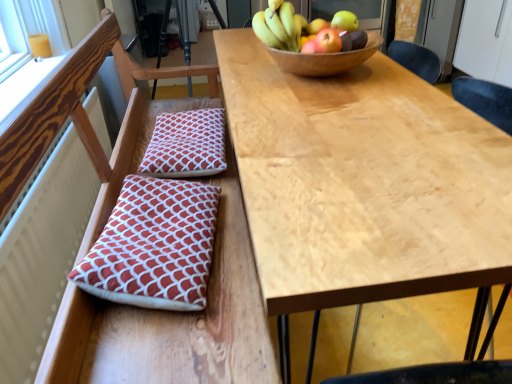
Question: From the image's perspective, is shiny yellow apple at upper right, acting as the 2th apple starting from the back, located above or below matte red apple at upper right, the 3th apple when ordered from back to front?

Choices:
 (A) below
 (B) above

Answer: (B)

Question: From their relative heights in the image, would you say shiny yellow apple at upper right, the 2th apple in the front-to-back sequence, is taller or shorter than matte red apple at upper right, the 3th apple when ordered from back to front?

Choices:
 (A) short
 (B) tall

Answer: (A)

Question: Which of these objects is positioned farthest from the matte red apple at upper right, arranged as the first apple when viewed from the front?

Choices:
 (A) red cotton cushion at center, marked as the second pillow in a front-to-back arrangement
 (B) shiny green apple at upper center, the 1th apple positioned from the back
 (C) red printed cushion at left, the first pillow ordered from the bottom
 (D) yellow matte bananas at upper center
 (E) red-patterned cushion at left

Answer: (E)

Question: Which object is the farthest from the red-patterned cushion at left?

Choices:
 (A) matte red apple at upper right, arranged as the first apple when viewed from the front
 (B) shiny green apple at upper center, the 1th apple positioned from the back
 (C) shiny yellow apple at upper right, the 2th apple in the front-to-back sequence
 (D) yellow matte bananas at upper center
 (E) red printed cushion at left, the first pillow ordered from the bottom

Answer: (C)